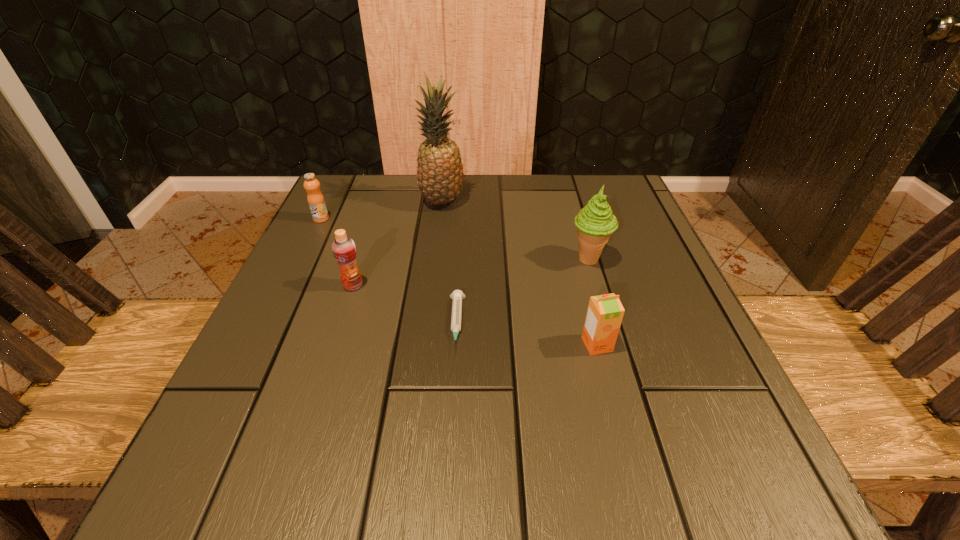
Find the location of a particular element. vacant space situated 0.160m on the left of the third farthest object is located at coordinates (488, 260).

Where is `free space located on the right of the second orange juice from right to left`? This screenshot has width=960, height=540. free space located on the right of the second orange juice from right to left is located at coordinates (401, 286).

The height and width of the screenshot is (540, 960). What are the coordinates of `free location located on the front label of the farthest orange juice` in the screenshot? It's located at (257, 350).

The width and height of the screenshot is (960, 540). I want to click on vacant area situated on the front of the nearest orange juice, so click(x=629, y=467).

Where is `vacant space located 0.190m at the needle end of the syringe`? The image size is (960, 540). vacant space located 0.190m at the needle end of the syringe is located at coordinates [448, 474].

Where is `pineapple that is positioned at the far edge`? This screenshot has height=540, width=960. pineapple that is positioned at the far edge is located at coordinates (440, 174).

This screenshot has width=960, height=540. Find the location of `orange juice that is at the far edge`. orange juice that is at the far edge is located at coordinates (315, 199).

Find the location of a particular element. The height and width of the screenshot is (540, 960). icecream at the right edge is located at coordinates (595, 223).

Locate an element on the screen. orange juice that is positioned at the right edge is located at coordinates (605, 312).

Identify the location of object that is at the far left corner. The image size is (960, 540). (315, 199).